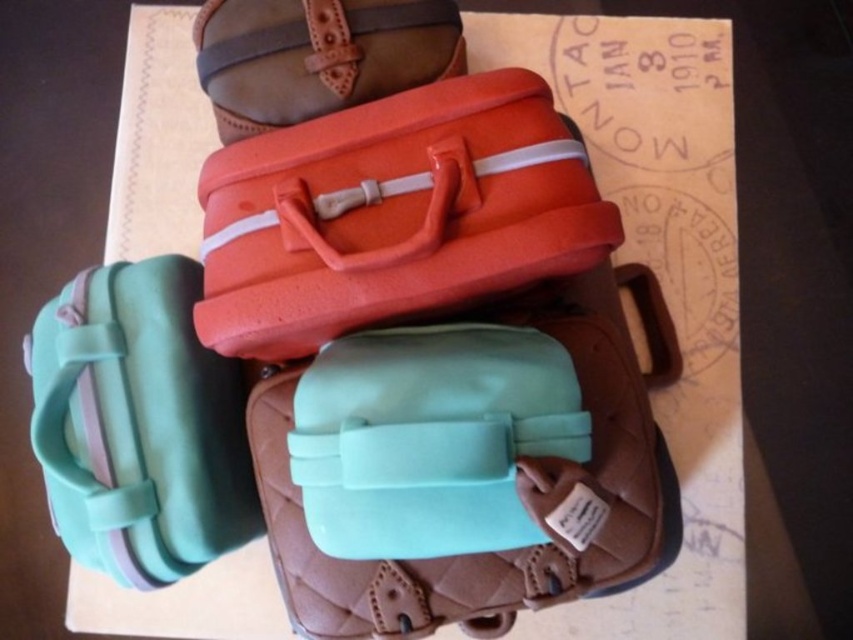
Is orange matte suitcase at center below matte orange suitcase at upper center?

Yes.

Is point (541, 209) farther from viewer compared to point (279, 120)?

That is False.

Which is behind, point (512, 134) or point (337, 12)?

Positioned behind is point (337, 12).

Identify the location of orange matte suitcase at center. The width and height of the screenshot is (853, 640). tap(393, 212).

Between mint green plastic suitcase at lower left and matte orange suitcase at upper center, which one appears on the left side from the viewer's perspective?

mint green plastic suitcase at lower left is more to the left.

Who is higher up, mint green plastic suitcase at lower left or matte orange suitcase at upper center?

matte orange suitcase at upper center

In order to click on mint green plastic suitcase at lower left in this screenshot , I will do `click(138, 424)`.

At what (x,y) coordinates should I click in order to perform the action: click on mint green plastic suitcase at lower left. Please return your answer as a coordinate pair (x, y). Looking at the image, I should click on (138, 424).

Which of these two, orange matte suitcase at center or mint green plastic suitcase at lower left, stands taller?

With more height is mint green plastic suitcase at lower left.

Does orange matte suitcase at center have a larger size compared to mint green plastic suitcase at lower left?

Yes, orange matte suitcase at center is bigger than mint green plastic suitcase at lower left.

Is point (485, 163) positioned in front of point (146, 419)?

Yes.

The height and width of the screenshot is (640, 853). Identify the location of orange matte suitcase at center. (393, 212).